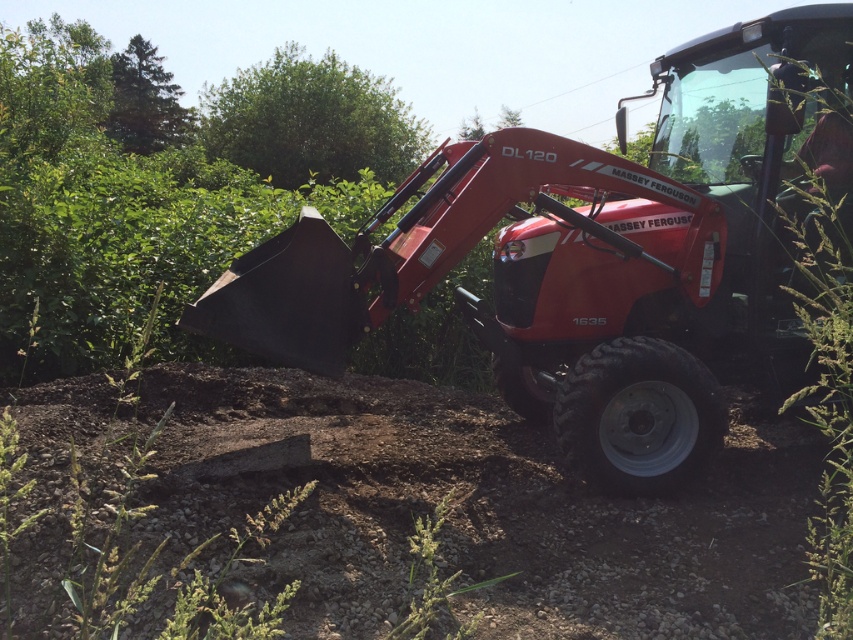
Based on the photo, is brown gravel dirt track at lower center positioned in front of metallic red tractor at center?

Yes, brown gravel dirt track at lower center is closer to the viewer.

Can you confirm if brown gravel dirt track at lower center is positioned above metallic red tractor at center?

No, brown gravel dirt track at lower center is not above metallic red tractor at center.

Find the location of a particular element. The image size is (853, 640). brown gravel dirt track at lower center is located at coordinates (474, 509).